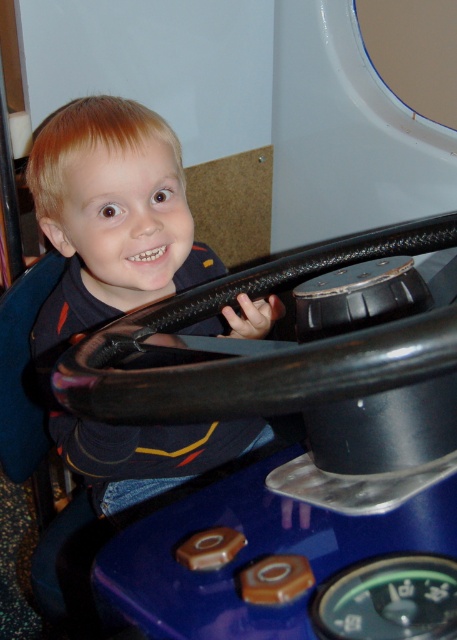
Question: Does matte black steering wheel at center appear over brown plastic button at center?

Choices:
 (A) no
 (B) yes

Answer: (B)

Question: Does black leather steering wheel at center have a lesser width compared to brown plastic button at center?

Choices:
 (A) no
 (B) yes

Answer: (A)

Question: Among these objects, which one is nearest to the camera?

Choices:
 (A) brown plastic button at center
 (B) matte black steering wheel at center

Answer: (A)

Question: Which of the following is the closest to the observer?

Choices:
 (A) (205, 563)
 (B) (54, 170)
 (C) (88, 385)

Answer: (C)

Question: Which point is farther to the camera?

Choices:
 (A) (99, 305)
 (B) (451, 227)

Answer: (A)

Question: Is matte black steering wheel at center to the left of brown plastic button at center from the viewer's perspective?

Choices:
 (A) no
 (B) yes

Answer: (B)